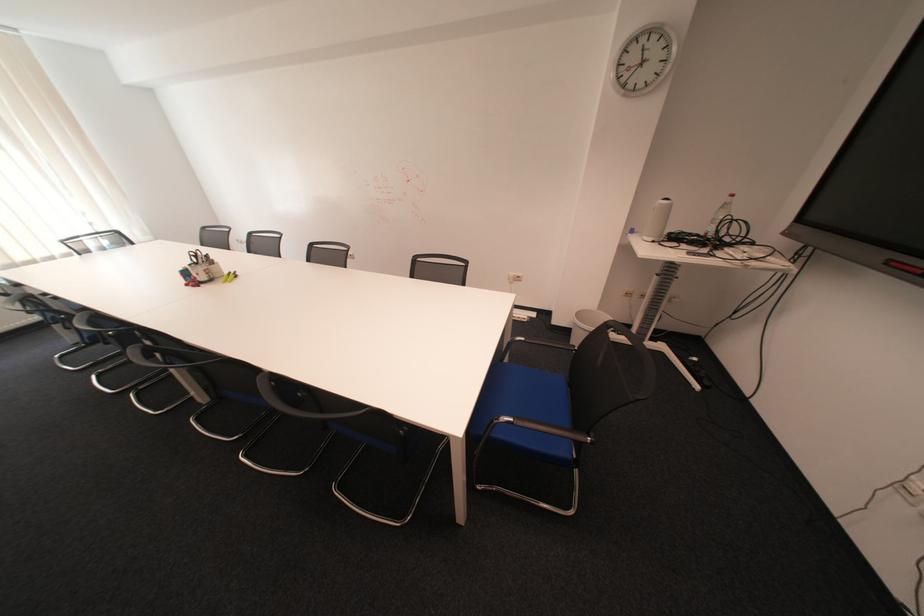
Where is `blue chair sitting surface`? The height and width of the screenshot is (616, 924). blue chair sitting surface is located at coordinates (531, 390).